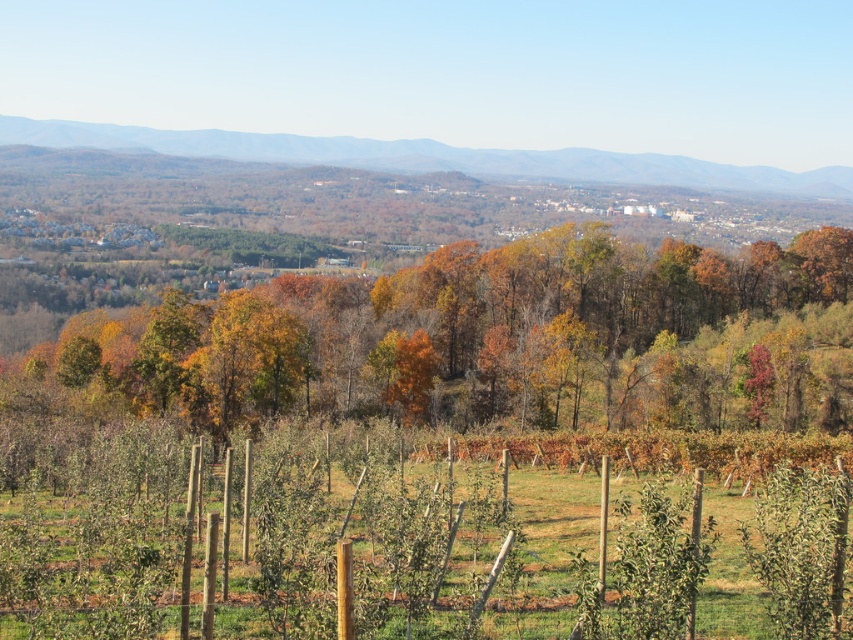
Question: Which point is farther to the camera?

Choices:
 (A) autumn leaves at center
 (B) brown/leaves hillside at upper center

Answer: (B)

Question: Considering the relative positions of autumn leaves at center and brown/leaves hillside at upper center in the image provided, where is autumn leaves at center located with respect to brown/leaves hillside at upper center?

Choices:
 (A) left
 (B) right

Answer: (B)

Question: Is autumn leaves at center wider than brown/leaves hillside at upper center?

Choices:
 (A) yes
 (B) no

Answer: (B)

Question: Does autumn leaves at center lie in front of brown/leaves hillside at upper center?

Choices:
 (A) yes
 (B) no

Answer: (A)